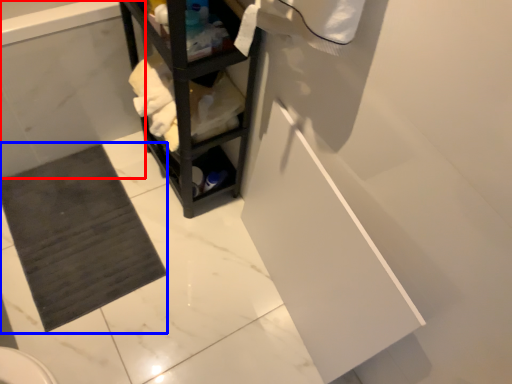
Question: Which point is further to the camera, bath (highlighted by a red box) or bath mat (highlighted by a blue box)?

Choices:
 (A) bath
 (B) bath mat

Answer: (B)